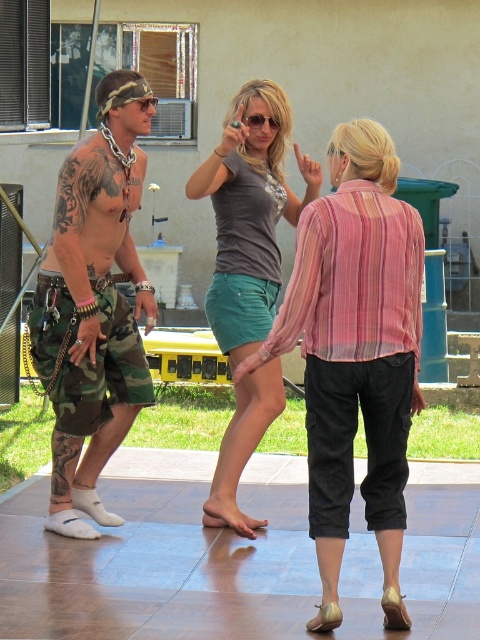
You are designing a layout for a clothing catalog and need to place the matte black shorts at center and the matte gray shirt at center next to each other. Based on their sizes, which item should you position first to ensure they fit properly?

The matte black shorts at center is larger in size than the matte gray shirt at center, so you should position the matte black shorts at center first to accommodate its larger size.